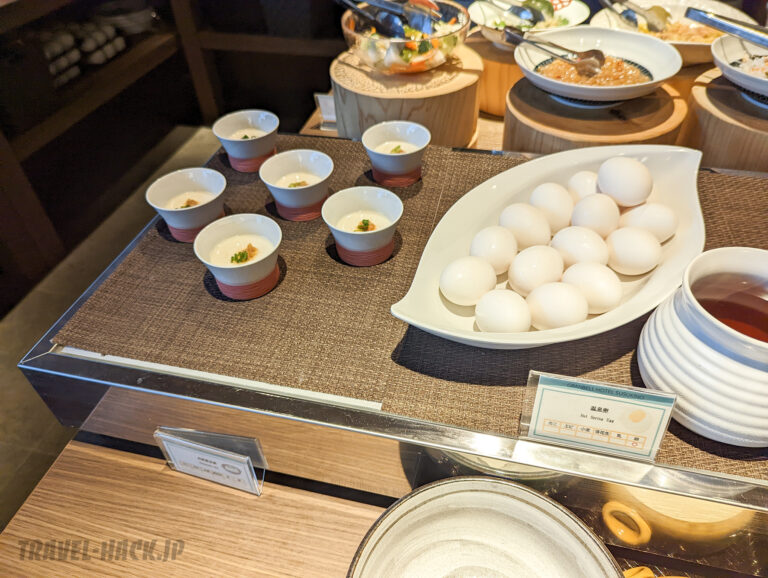
The image size is (768, 578). I want to click on oval shaped white tray, so click(419, 313).